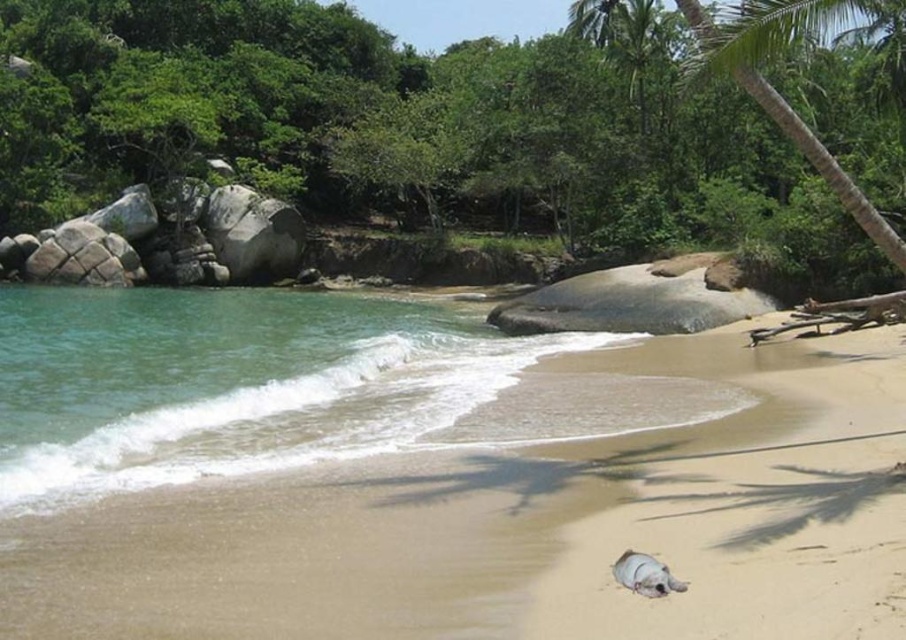
Question: Which object is positioned closest to the green leafy palm tree at upper right?

Choices:
 (A) clear water at lower left
 (B) gray matte turtle at lower center

Answer: (B)

Question: Does clear water at lower left appear on the left side of green leafy palm tree at upper right?

Choices:
 (A) no
 (B) yes

Answer: (B)

Question: Does light brown sand at lower center have a larger size compared to green leafy palm tree at upper right?

Choices:
 (A) no
 (B) yes

Answer: (A)

Question: Among these points, which one is farthest from the camera?

Choices:
 (A) (224, 403)
 (B) (707, 598)

Answer: (A)

Question: Is light brown sand at lower center positioned in front of gray matte turtle at lower center?

Choices:
 (A) no
 (B) yes

Answer: (B)

Question: Among these objects, which one is farthest from the camera?

Choices:
 (A) green leafy palm tree at upper right
 (B) light brown sand at lower center
 (C) gray matte turtle at lower center
 (D) clear water at lower left

Answer: (D)